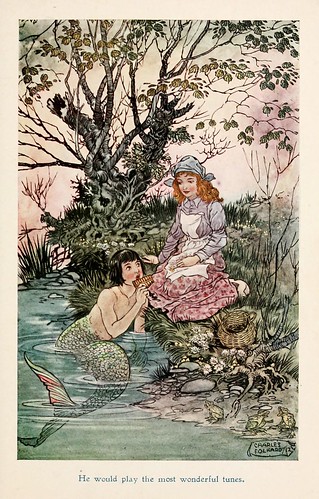
Locate an element on the screen. The width and height of the screenshot is (319, 499). artwork is located at coordinates (181, 385).